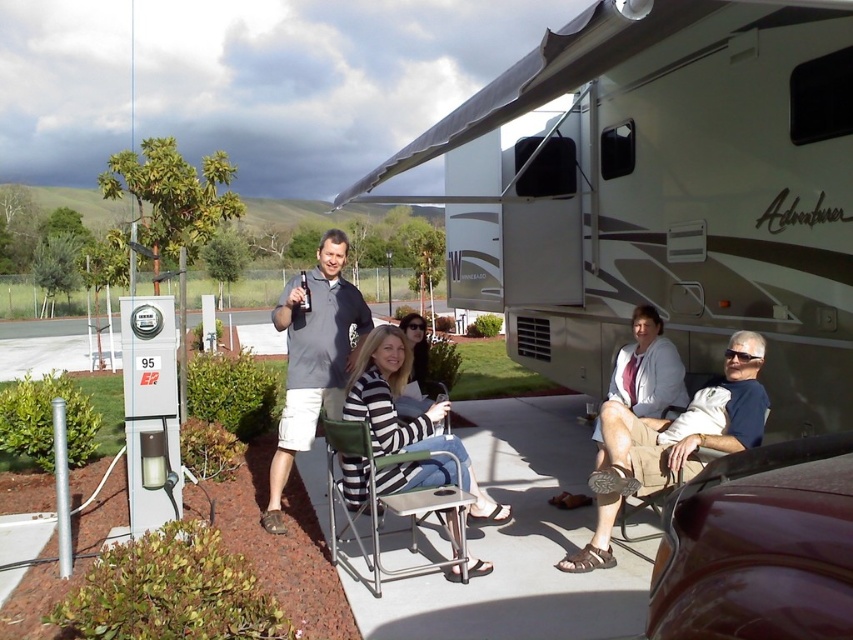
Can you confirm if striped fabric shirt at center is thinner than gray cotton shirt at center?

Incorrect, striped fabric shirt at center's width is not less than gray cotton shirt at center's.

Looking at this image, is striped fabric shirt at center to the right of gray cotton shirt at center from the viewer's perspective?

Correct, you'll find striped fabric shirt at center to the right of gray cotton shirt at center.

Is point (695, 404) farther from viewer compared to point (325, 285)?

No, (695, 404) is in front of (325, 285).

Where is `striped fabric shirt at center`? The image size is (853, 640). striped fabric shirt at center is located at coordinates (671, 440).

Is white textured rv at center positioned in front of green fabric folding chair at center?

No, white textured rv at center is behind green fabric folding chair at center.

Is point (688, 365) closer to camera compared to point (405, 449)?

No, it is not.

At what (x,y) coordinates should I click in order to perform the action: click on white textured rv at center. Please return your answer as a coordinate pair (x, y). This screenshot has height=640, width=853. Looking at the image, I should click on (660, 195).

Who is more forward, (566, 170) or (612, 468)?

Point (612, 468)

Consider the image. Measure the distance between white textured rv at center and dark blue t-shirt at center.

white textured rv at center and dark blue t-shirt at center are 2.70 meters apart.

Image resolution: width=853 pixels, height=640 pixels. What do you see at coordinates (660, 195) in the screenshot?
I see `white textured rv at center` at bounding box center [660, 195].

The height and width of the screenshot is (640, 853). In order to click on white textured rv at center in this screenshot , I will do `click(660, 195)`.